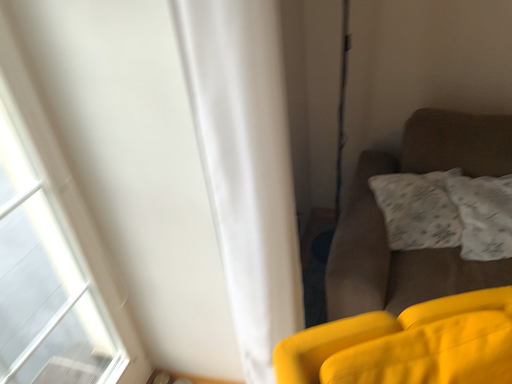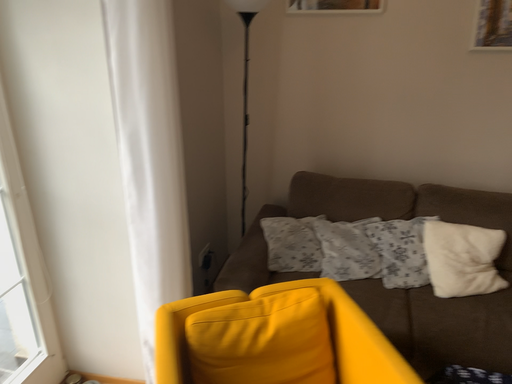
Question: Which way did the camera rotate in the video?

Choices:
 (A) rotated downward
 (B) rotated upward

Answer: (B)